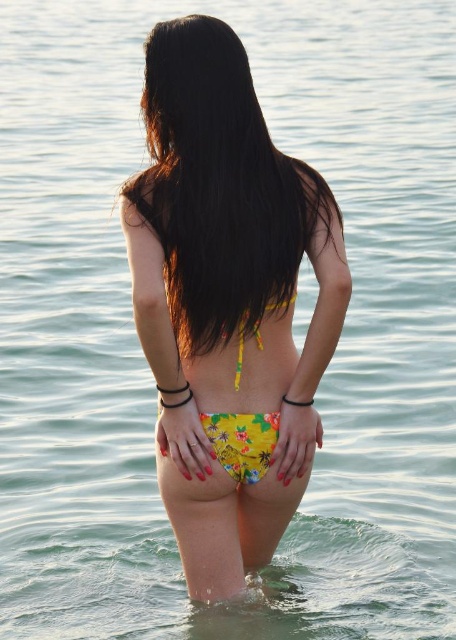
Question: Which object is closer to the camera taking this photo?

Choices:
 (A) yellow floral bikini bottom at center
 (B) yellow floral fabric bikini top at center

Answer: (A)

Question: Does yellow floral bikini bottom at center have a larger size compared to yellow floral fabric bikini top at center?

Choices:
 (A) yes
 (B) no

Answer: (A)

Question: Can you confirm if yellow floral bikini bottom at center is positioned to the left of yellow floral fabric bikini top at center?

Choices:
 (A) no
 (B) yes

Answer: (B)

Question: Which point is closer to the camera?

Choices:
 (A) yellow floral fabric bikini top at center
 (B) yellow floral bikini bottom at center

Answer: (B)

Question: Is yellow floral bikini bottom at center closer to the viewer compared to yellow floral fabric bikini top at center?

Choices:
 (A) yes
 (B) no

Answer: (A)